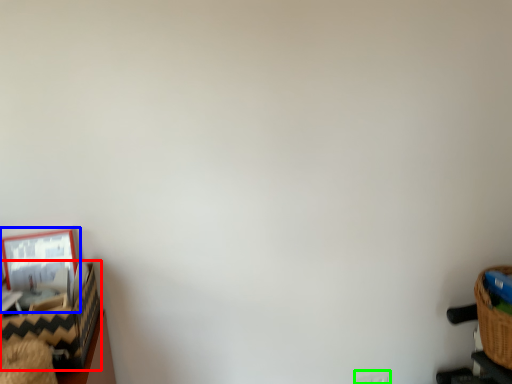
Question: Which object is positioned closest to basket (highlighted by a red box)? Select from picture frame (highlighted by a blue box) and electric outlet (highlighted by a green box).

Choices:
 (A) picture frame
 (B) electric outlet

Answer: (A)